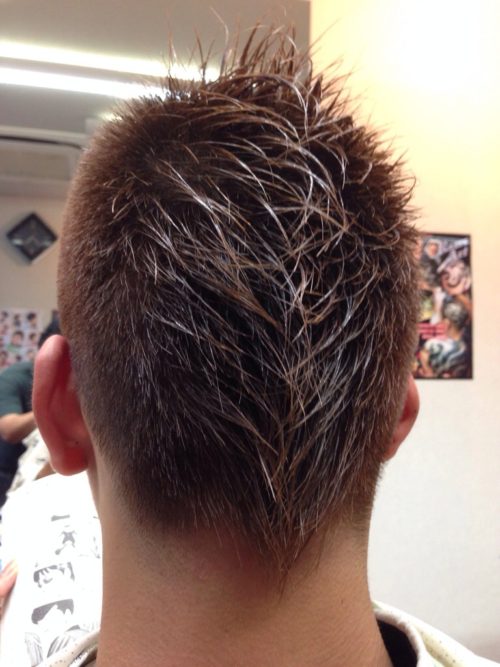
Where is `poster`? This screenshot has height=667, width=500. poster is located at coordinates (455, 315).